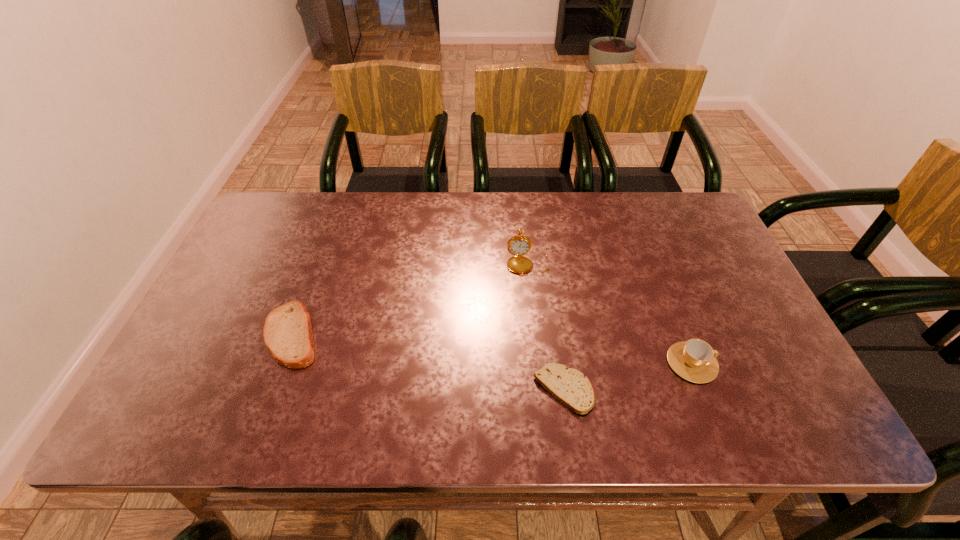
Where is `free space that is in between the pocket watch and the taller pita bread`? The width and height of the screenshot is (960, 540). free space that is in between the pocket watch and the taller pita bread is located at coordinates (410, 299).

The image size is (960, 540). In order to click on object that stands as the closest to the shorter pita bread in this screenshot , I will do `click(694, 360)`.

Identify which object is located as the second nearest to the farthest object. Please provide its 2D coordinates. Your answer should be formatted as a tuple, i.e. [(x, y)], where the tuple contains the x and y coordinates of a point satisfying the conditions above.

[(694, 360)]

Locate an element on the screen. free space that satisfies the following two spatial constraints: 1. on the front side of the taller pita bread; 2. on the left side of the shorter pita bread is located at coordinates (272, 390).

I want to click on vacant region that satisfies the following two spatial constraints: 1. on the face of the tallest object; 2. on the right side of the right pita bread, so click(x=540, y=390).